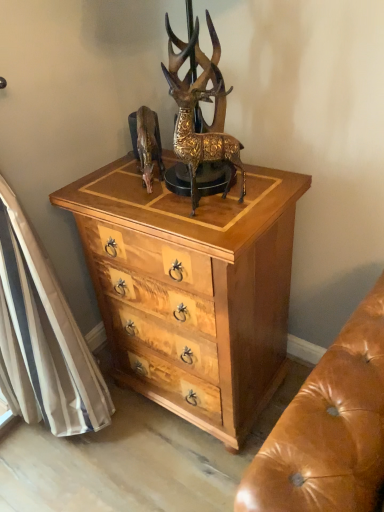
Question: Does light wood/texture chest of drawers at center appear on the right side of shiny brown deer at center?

Choices:
 (A) no
 (B) yes

Answer: (B)

Question: Does light wood/texture chest of drawers at center have a greater height compared to shiny brown deer at center?

Choices:
 (A) no
 (B) yes

Answer: (B)

Question: From a real-world perspective, does light wood/texture chest of drawers at center stand above shiny brown deer at center?

Choices:
 (A) no
 (B) yes

Answer: (A)

Question: Does light wood/texture chest of drawers at center have a greater width compared to shiny brown deer at center?

Choices:
 (A) yes
 (B) no

Answer: (A)

Question: Is shiny brown deer at center completely or partially inside light wood/texture chest of drawers at center?

Choices:
 (A) no
 (B) yes

Answer: (A)

Question: Considering the positions of gold textured deer at center and shiny brown deer at center in the image, is gold textured deer at center bigger or smaller than shiny brown deer at center?

Choices:
 (A) big
 (B) small

Answer: (A)

Question: Looking at their shapes, would you say gold textured deer at center is wider or thinner than shiny brown deer at center?

Choices:
 (A) wide
 (B) thin

Answer: (B)

Question: Do you think gold textured deer at center is within shiny brown deer at center, or outside of it?

Choices:
 (A) inside
 (B) outside

Answer: (B)

Question: From a real-world perspective, relative to shiny brown deer at center, is gold textured deer at center vertically above or below?

Choices:
 (A) above
 (B) below

Answer: (A)

Question: In the image, is shiny brown deer at center on the left side or the right side of light wood/texture chest of drawers at center?

Choices:
 (A) left
 (B) right

Answer: (A)

Question: Is shiny brown deer at center inside the boundaries of light wood/texture chest of drawers at center, or outside?

Choices:
 (A) inside
 (B) outside

Answer: (B)

Question: In terms of size, does shiny brown deer at center appear bigger or smaller than light wood/texture chest of drawers at center?

Choices:
 (A) big
 (B) small

Answer: (B)

Question: From a real-world perspective, is shiny brown deer at center above or below light wood/texture chest of drawers at center?

Choices:
 (A) above
 (B) below

Answer: (A)

Question: Based on their sizes in the image, would you say light wood/texture chest of drawers at center is bigger or smaller than shiny brown deer at center?

Choices:
 (A) big
 (B) small

Answer: (A)

Question: From their relative heights in the image, would you say light wood/texture chest of drawers at center is taller or shorter than shiny brown deer at center?

Choices:
 (A) short
 (B) tall

Answer: (B)